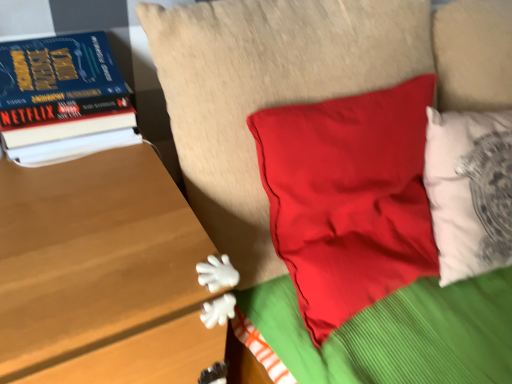
Question: Can you confirm if wooden table at left is smaller than matte red pillow at center?

Choices:
 (A) no
 (B) yes

Answer: (A)

Question: Is wooden table at left further to camera compared to matte red pillow at center?

Choices:
 (A) no
 (B) yes

Answer: (A)

Question: From the image's perspective, is wooden table at left above matte red pillow at center?

Choices:
 (A) no
 (B) yes

Answer: (A)

Question: Is wooden table at left to the right of matte red pillow at center from the viewer's perspective?

Choices:
 (A) yes
 (B) no

Answer: (B)

Question: Can you confirm if wooden table at left is shorter than matte red pillow at center?

Choices:
 (A) yes
 (B) no

Answer: (B)

Question: Is matte red pillow at center in front of or behind wooden table at left in the image?

Choices:
 (A) front
 (B) behind

Answer: (B)

Question: In terms of height, does matte red pillow at center look taller or shorter compared to wooden table at left?

Choices:
 (A) short
 (B) tall

Answer: (A)

Question: Considering the positions of matte red pillow at center and wooden table at left in the image, is matte red pillow at center bigger or smaller than wooden table at left?

Choices:
 (A) big
 (B) small

Answer: (B)

Question: From the image's perspective, relative to wooden table at left, is matte red pillow at center above or below?

Choices:
 (A) above
 (B) below

Answer: (A)

Question: Considering the positions of wooden table at left and hardcover book at left in the image, is wooden table at left bigger or smaller than hardcover book at left?

Choices:
 (A) small
 (B) big

Answer: (B)

Question: Is wooden table at left taller or shorter than hardcover book at left?

Choices:
 (A) tall
 (B) short

Answer: (A)

Question: Relative to hardcover book at left, is wooden table at left in front or behind?

Choices:
 (A) behind
 (B) front

Answer: (B)

Question: In terms of width, does wooden table at left look wider or thinner when compared to hardcover book at left?

Choices:
 (A) thin
 (B) wide

Answer: (B)

Question: Is wooden table at left bigger or smaller than matte red pillow at center?

Choices:
 (A) small
 (B) big

Answer: (B)

Question: From a real-world perspective, is wooden table at left above or below matte red pillow at center?

Choices:
 (A) below
 (B) above

Answer: (A)